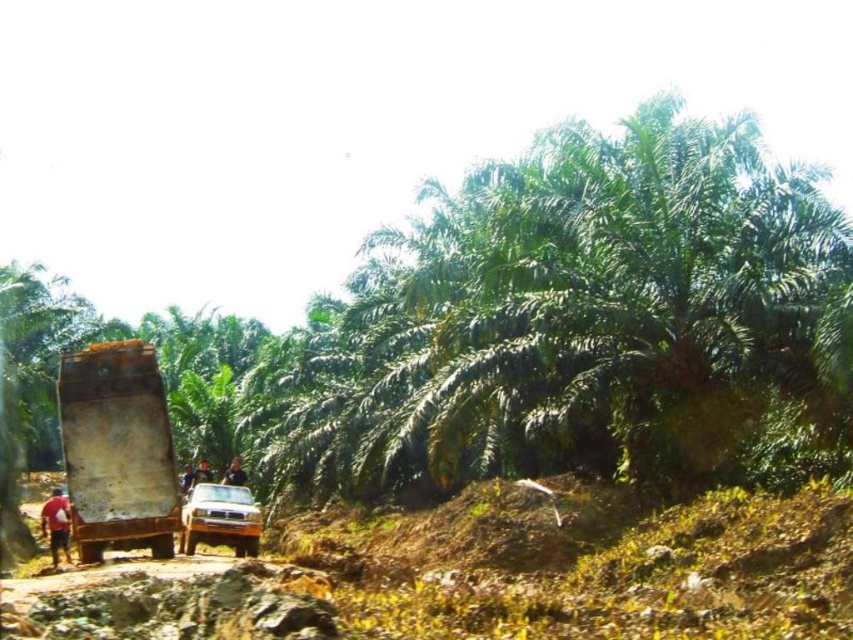
Consider the image. Between metallic silver suv at center and red fabric shirt at lower left, which one has less height?

With less height is metallic silver suv at center.

Can you confirm if metallic silver suv at center is shorter than red fabric shirt at lower left?

Yes.

This screenshot has width=853, height=640. In order to click on metallic silver suv at center in this screenshot , I will do `click(219, 518)`.

Where is `metallic silver suv at center`? This screenshot has height=640, width=853. metallic silver suv at center is located at coordinates (219, 518).

Who is more forward, (x=76, y=534) or (x=242, y=483)?

Point (x=76, y=534)

From the picture: Between rusty metal truck at center and dark blue shirt at center, which one appears on the left side from the viewer's perspective?

From the viewer's perspective, dark blue shirt at center appears more on the left side.

Which is in front, point (85, 529) or point (242, 477)?

Point (85, 529) is more forward.

Find the location of a particular element. Image resolution: width=853 pixels, height=640 pixels. rusty metal truck at center is located at coordinates (117, 449).

Measure the distance from rusty metal truck at center to blue fabric shirt at center.

A distance of 15.46 meters exists between rusty metal truck at center and blue fabric shirt at center.

Does rusty metal truck at center have a greater width compared to blue fabric shirt at center?

No, rusty metal truck at center is not wider than blue fabric shirt at center.

What do you see at coordinates (117, 449) in the screenshot? Image resolution: width=853 pixels, height=640 pixels. I see `rusty metal truck at center` at bounding box center [117, 449].

Where is `rusty metal truck at center`? Image resolution: width=853 pixels, height=640 pixels. rusty metal truck at center is located at coordinates (117, 449).